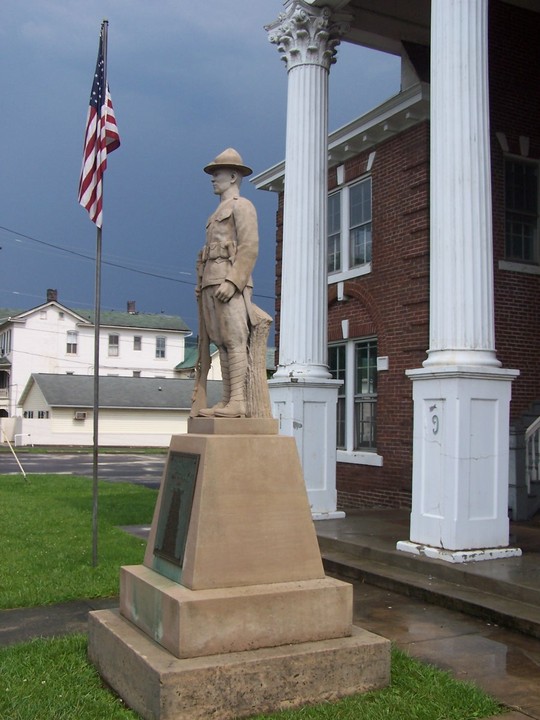
Locate an element on the screen. The height and width of the screenshot is (720, 540). chimeny is located at coordinates (132, 307), (54, 294), (197, 341).